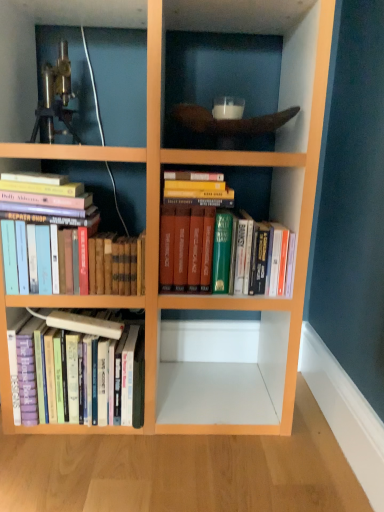
The image size is (384, 512). What are the coordinates of `free space in front of hardcover books at lower left, which appears as the first book when viewed from the left` in the screenshot? It's located at (76, 466).